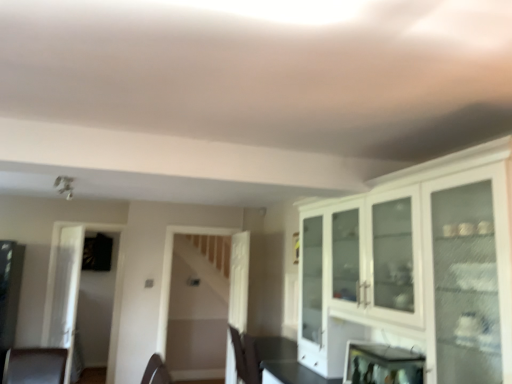
Describe the element at coordinates (239, 280) in the screenshot. I see `white wood door at center` at that location.

What is the approximate width of metallic reflective mirror at lower right?

metallic reflective mirror at lower right is 23.57 centimeters in width.

Find the location of a particular element. The image size is (512, 384). brown leather chair at lower left is located at coordinates (245, 357).

Measure the distance between point (x=469, y=284) and camera.

Point (x=469, y=284) and camera are 2.09 meters apart from each other.

At what (x,y) coordinates should I click in order to perform the action: click on transparent glass door at left. Please return your answer as a coordinate pair (x, y). Looking at the image, I should click on (65, 291).

This screenshot has height=384, width=512. Find the location of `door behind the white glossy cabinet at upper right`. door behind the white glossy cabinet at upper right is located at coordinates (239, 280).

Can you confirm if white wood door at center is smaller than white glossy cabinet at upper right?

Yes, white wood door at center is smaller than white glossy cabinet at upper right.

Considering the relative sizes of white wood door at center and white glossy cabinet at upper right in the image provided, is white wood door at center taller than white glossy cabinet at upper right?

Yes.

Considering the points (229, 321) and (456, 359), which point is behind, point (229, 321) or point (456, 359)?

Point (229, 321)

Is white glossy cabinet at upper right looking in the opposite direction of brown leather chair at lower left?

No.

Does point (395, 271) appear closer or farther from the camera than point (234, 342)?

Point (395, 271) is closer to the camera than point (234, 342).

Where is `cabinetry above the brown leather chair at lower left (from a real-world perspective)`? cabinetry above the brown leather chair at lower left (from a real-world perspective) is located at coordinates (420, 265).

Based on the photo, measure the distance from white glossy cabinet at upper right to brown leather chair at lower left.

white glossy cabinet at upper right and brown leather chair at lower left are 1.38 meters apart from each other.

Does brown leather chair at lower left have a greater width compared to white wood door at center?

Yes, brown leather chair at lower left is wider than white wood door at center.

In terms of size, does brown leather chair at lower left appear bigger or smaller than white wood door at center?

Considering their sizes, brown leather chair at lower left takes up more space than white wood door at center.

Can you tell me how much brown leather chair at lower left and white wood door at center differ in facing direction?

The facing directions of brown leather chair at lower left and white wood door at center are 179 degrees apart.

Identify the location of chair that appears on the right of white wood door at center. (245, 357).

How many degrees apart are the facing directions of transparent glass door at left and brown leather chair at lower left?

There is a 26.3-degree angle between the facing directions of transparent glass door at left and brown leather chair at lower left.

Is point (56, 254) positioned behind point (252, 366)?

Yes, point (56, 254) is farther from viewer.

Is brown leather chair at lower left at the back of transparent glass door at left?

No.

Is transparent glass door at left positioned beyond the bounds of brown leather chair at lower left?

transparent glass door at left lies outside brown leather chair at lower left's area.

What's the angular difference between metallic reflective mirror at lower right and transparent glass door at left's facing directions?

155 degrees separate the facing orientations of metallic reflective mirror at lower right and transparent glass door at left.

Is metallic reflective mirror at lower right at the left side of transparent glass door at left?

No, metallic reflective mirror at lower right is not to the left of transparent glass door at left.

Is point (422, 367) positioned before point (69, 328)?

Yes.

Is metallic reflective mirror at lower right further to camera compared to transparent glass door at left?

No, the depth of metallic reflective mirror at lower right is less than that of transparent glass door at left.

Considering the points (416, 346) and (345, 367), which point is behind, point (416, 346) or point (345, 367)?

The point (345, 367) is behind.

Is white glossy cabinet at upper right taller than metallic reflective mirror at lower right?

Correct, white glossy cabinet at upper right is much taller as metallic reflective mirror at lower right.

Does white glossy cabinet at upper right have a larger size compared to metallic reflective mirror at lower right?

Yes, white glossy cabinet at upper right is bigger than metallic reflective mirror at lower right.

Based on the photo, measure the distance from white wood door at center to brown leather chair at lower left.

39.33 inches.

Is white wood door at center situated inside brown leather chair at lower left or outside?

white wood door at center is spatially situated outside brown leather chair at lower left.

Does white wood door at center have a greater height compared to brown leather chair at lower left?

Yes, white wood door at center is taller than brown leather chair at lower left.

Does white wood door at center have a lesser width compared to brown leather chair at lower left?

Yes, white wood door at center is thinner than brown leather chair at lower left.

Locate an element on the screen. The image size is (512, 384). cabinetry that is above the white wood door at center (from a real-world perspective) is located at coordinates (420, 265).

Identify the location of chair that is under the white glossy cabinet at upper right (from a real-world perspective). (245, 357).

Based on their spatial positions, is white wood door at center or brown leather chair at lower left closer to transparent glass door at left?

white wood door at center is positioned closer to the anchor transparent glass door at left.

Estimate the real-world distances between objects in this image. Which object is closer to white wood door at center, transparent glass door at left or white glossy cabinet at upper right?

transparent glass door at left is closer to white wood door at center.

Based on their spatial positions, is brown leather chair at lower left or white glossy cabinet at upper right further from white wood door at center?

white glossy cabinet at upper right.

Looking at the image, which one is located closer to metallic reflective mirror at lower right, brown leather chair at lower left or white wood door at center?

brown leather chair at lower left is closer to metallic reflective mirror at lower right.

Estimate the real-world distances between objects in this image. Which object is further from metallic reflective mirror at lower right, brown leather chair at lower left or transparent glass door at left?

transparent glass door at left lies further to metallic reflective mirror at lower right than the other object.

Which object lies further to the anchor point metallic reflective mirror at lower right, transparent glass door at left or white wood door at center?

Based on the image, transparent glass door at left appears to be further to metallic reflective mirror at lower right.

From the image, which object appears to be farther from white glossy cabinet at upper right, white wood door at center or brown leather chair at lower left?

white wood door at center is positioned further to the anchor white glossy cabinet at upper right.

Based on their spatial positions, is white glossy cabinet at upper right or brown leather chair at lower left further from transparent glass door at left?

The object further to transparent glass door at left is white glossy cabinet at upper right.

This screenshot has width=512, height=384. In order to click on cabinetry between transparent glass door at left and metallic reflective mirror at lower right in this screenshot , I will do `click(420, 265)`.

Locate an element on the screen. chair located between white glossy cabinet at upper right and white wood door at center in the depth direction is located at coordinates (245, 357).

Identify the location of chair positioned between white glossy cabinet at upper right and transparent glass door at left from near to far. Image resolution: width=512 pixels, height=384 pixels. (245, 357).

Find the location of `chair located between metallic reflective mirror at lower right and white wood door at center in the depth direction`. chair located between metallic reflective mirror at lower right and white wood door at center in the depth direction is located at coordinates (245, 357).